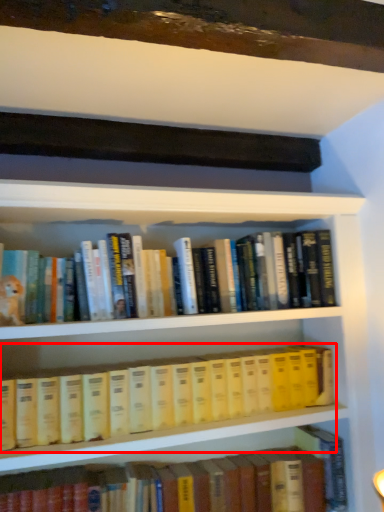
Question: From the image's perspective, where is book (annotated by the red box) located relative to book?

Choices:
 (A) above
 (B) below

Answer: (A)